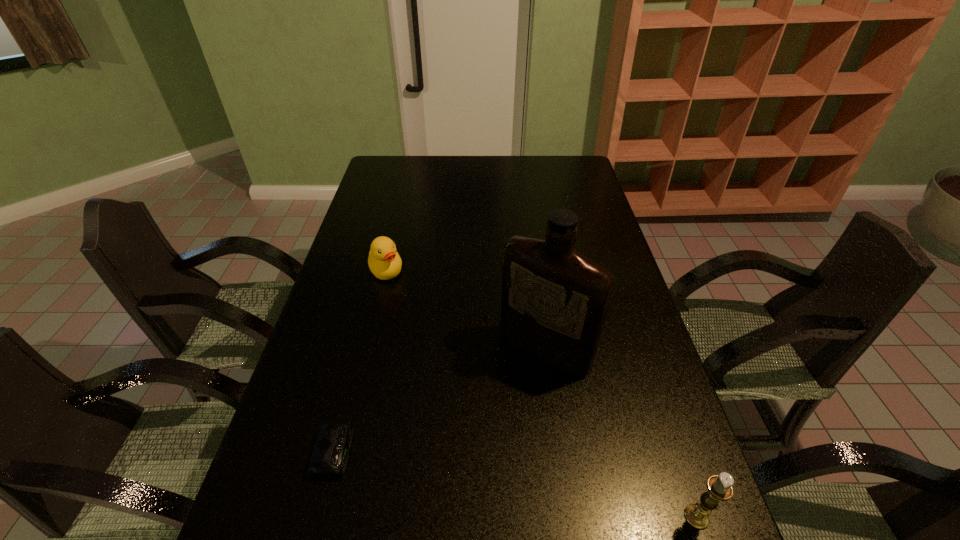
I want to click on free space located 0.110m at the beak of the third tallest object, so click(x=397, y=307).

This screenshot has width=960, height=540. Identify the location of vacant region located 0.210m at the beak of the third tallest object. (406, 332).

Locate an element on the screen. This screenshot has height=540, width=960. vacant space located 0.140m at the beak of the third tallest object is located at coordinates (400, 314).

The image size is (960, 540). What are the coordinates of `vacant space situated 0.230m on the label side of the liquor` in the screenshot? It's located at (468, 446).

What are the coordinates of `free location located on the label side of the liquor` in the screenshot? It's located at (509, 390).

Find the location of a particular element. The image size is (960, 540). blank area located 0.300m on the label side of the liquor is located at coordinates (447, 471).

The image size is (960, 540). In order to click on object present at the near edge in this screenshot , I will do pos(719,487).

Identify the location of alarm clock that is at the left edge. The width and height of the screenshot is (960, 540). (329, 457).

At what (x,y) coordinates should I click in order to perform the action: click on duck at the left edge. Please return your answer as a coordinate pair (x, y). Looking at the image, I should click on (384, 261).

Find the location of a particular element. The image size is (960, 540). object present at the right edge is located at coordinates (719, 487).